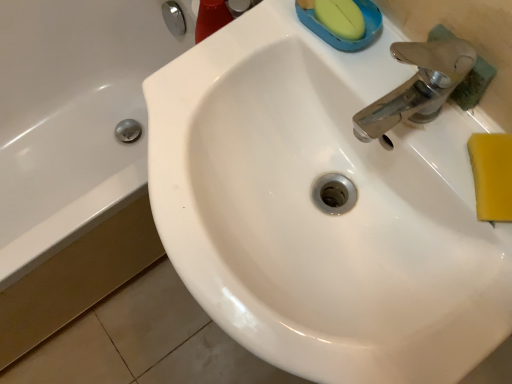
Question: Does yellow sponge at right appear on the right side of white glossy bathtub at left?

Choices:
 (A) yes
 (B) no

Answer: (A)

Question: From a real-world perspective, is yellow sponge at right physically above white glossy bathtub at left?

Choices:
 (A) no
 (B) yes

Answer: (B)

Question: From the image's perspective, is yellow sponge at right under white glossy bathtub at left?

Choices:
 (A) yes
 (B) no

Answer: (A)

Question: Considering the relative sizes of yellow sponge at right and white glossy bathtub at left in the image provided, is yellow sponge at right bigger than white glossy bathtub at left?

Choices:
 (A) yes
 (B) no

Answer: (B)

Question: Is the depth of yellow sponge at right greater than that of white glossy bathtub at left?

Choices:
 (A) yes
 (B) no

Answer: (B)

Question: Is yellow sponge at right directly adjacent to white glossy bathtub at left?

Choices:
 (A) no
 (B) yes

Answer: (A)

Question: Considering the relative sizes of white glossy sink at center and yellow sponge at right in the image provided, is white glossy sink at center bigger than yellow sponge at right?

Choices:
 (A) no
 (B) yes

Answer: (B)

Question: From a real-world perspective, is white glossy sink at center positioned under yellow sponge at right based on gravity?

Choices:
 (A) yes
 (B) no

Answer: (A)

Question: Is white glossy sink at center taller than yellow sponge at right?

Choices:
 (A) yes
 (B) no

Answer: (A)

Question: Is white glossy sink at center facing towards yellow sponge at right?

Choices:
 (A) no
 (B) yes

Answer: (A)

Question: Can you confirm if white glossy sink at center is smaller than yellow sponge at right?

Choices:
 (A) no
 (B) yes

Answer: (A)

Question: Is white glossy sink at center at the left side of yellow sponge at right?

Choices:
 (A) yes
 (B) no

Answer: (A)

Question: Is white glossy bathtub at left looking in the opposite direction of white glossy sink at center?

Choices:
 (A) yes
 (B) no

Answer: (B)